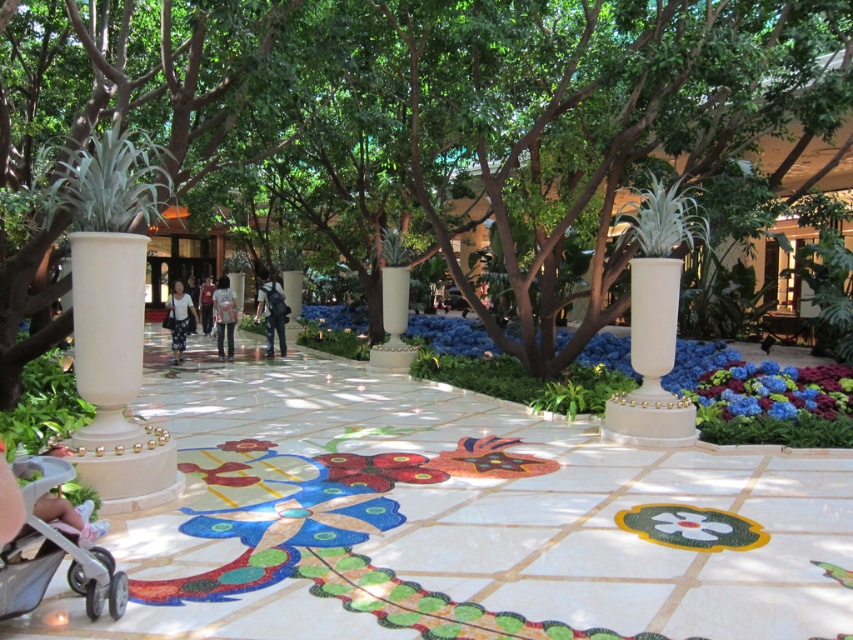
Is blue velvet flowers at center right positioned behind dark blue jeans at center?

No, blue velvet flowers at center right is closer to the viewer.

Who is higher up, blue velvet flowers at center right or dark blue jeans at center?

dark blue jeans at center is above.

Which is in front, point (753, 397) or point (279, 326)?

Positioned in front is point (753, 397).

This screenshot has width=853, height=640. In order to click on blue velvet flowers at center right in this screenshot , I will do `click(773, 390)`.

Which is in front, point (849, 371) or point (178, 294)?

Positioned in front is point (849, 371).

Which is below, blue velvet flowers at center right or white cotton dress at center?

blue velvet flowers at center right is lower down.

In order to click on blue velvet flowers at center right in this screenshot , I will do `click(773, 390)`.

Between point (521, 176) and point (231, 342), which one is positioned in front?

Positioned in front is point (521, 176).

Which is behind, point (639, 76) or point (219, 348)?

Positioned behind is point (219, 348).

Does point (374, 77) lie in front of point (213, 312)?

Yes, it is.

Find the location of `green leafy tree at center`. green leafy tree at center is located at coordinates (439, 106).